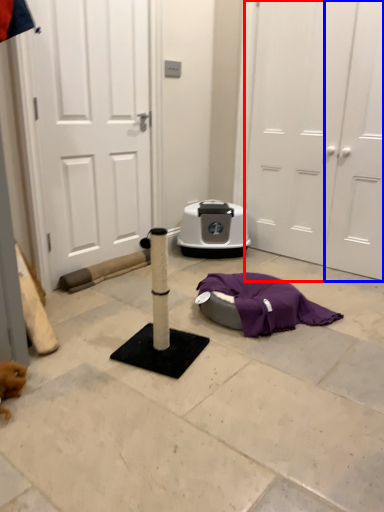
Question: Which object is closer to the camera taking this photo, door (highlighted by a red box) or door (highlighted by a blue box)?

Choices:
 (A) door
 (B) door

Answer: (A)